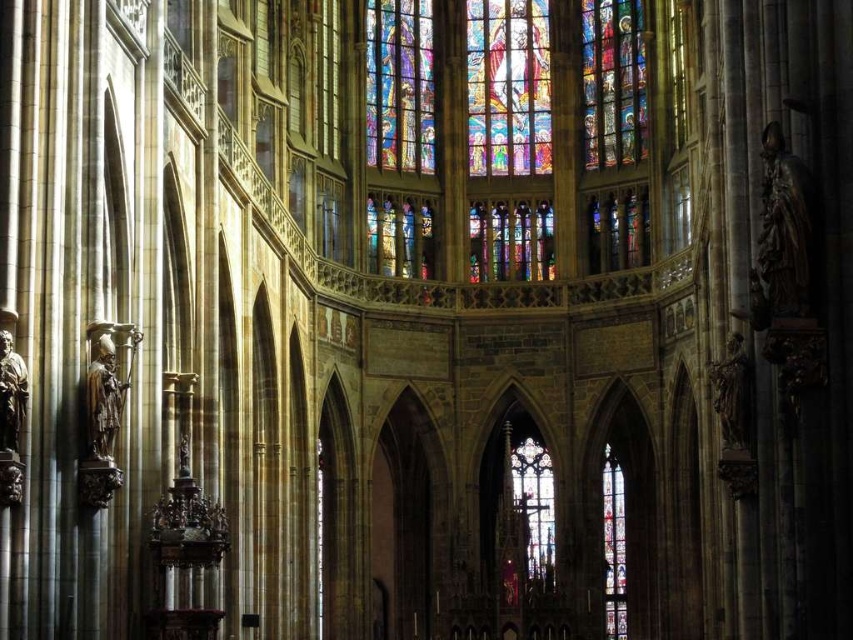
Question: Is multicolored stained glass window at center below stained glass window at center?

Choices:
 (A) no
 (B) yes

Answer: (A)

Question: Can you confirm if multicolored stained glass window at upper right is wider than stained glass window at center?

Choices:
 (A) yes
 (B) no

Answer: (A)

Question: Estimate the real-world distances between objects in this image. Which object is closer to the stained glass window at center?

Choices:
 (A) multicolored stained glass window at center
 (B) multicolored stained glass window at upper right

Answer: (B)

Question: Based on their relative distances, which object is nearer to the multicolored stained glass window at upper right?

Choices:
 (A) multicolored stained glass window at center
 (B) stained glass window at center

Answer: (A)

Question: Is multicolored stained glass window at center positioned at the back of stained glass window at center?

Choices:
 (A) no
 (B) yes

Answer: (A)

Question: Which object appears farthest from the camera in this image?

Choices:
 (A) stained glass window at center
 (B) multicolored stained glass window at center
 (C) multicolored stained glass window at upper right

Answer: (A)